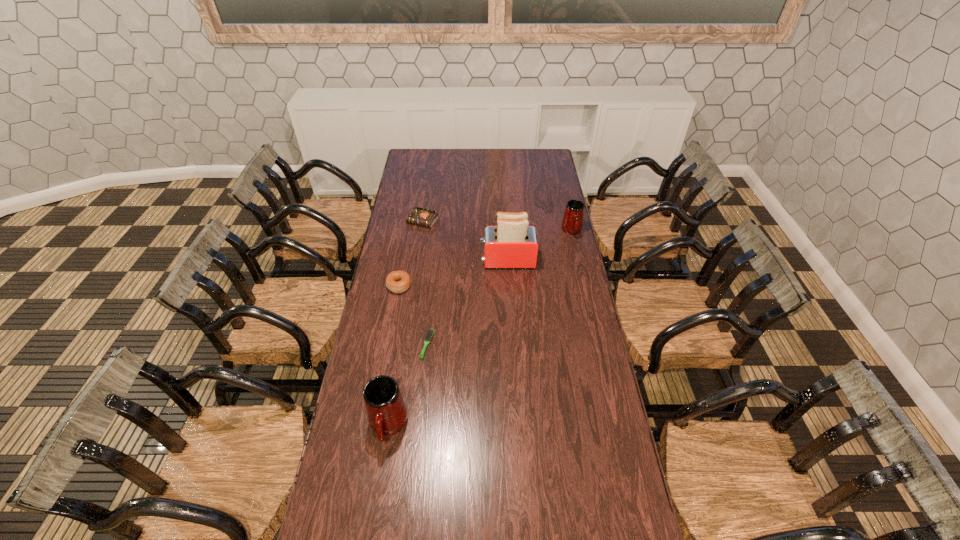
Locate an element on the screen. free space located on the side of the fifth shortest object with the handle is located at coordinates (381, 474).

At what (x,y) coordinates should I click in order to perform the action: click on free space located on the front-facing side of the tallest object. Please return your answer as a coordinate pair (x, y). Image resolution: width=960 pixels, height=540 pixels. Looking at the image, I should click on (435, 261).

Find the location of `free space located on the front-facing side of the tallest object`. free space located on the front-facing side of the tallest object is located at coordinates (415, 261).

Find the location of a particular element. This screenshot has height=540, width=960. free space located on the front-facing side of the tallest object is located at coordinates (396, 261).

Where is `vacant space situated on the back of the diary`? The width and height of the screenshot is (960, 540). vacant space situated on the back of the diary is located at coordinates (426, 197).

Find the location of a particular element. The width and height of the screenshot is (960, 540). blank area located 0.360m on the right of the third nearest object is located at coordinates (494, 286).

Identify the location of vacant region located 0.120m on the back of the hairbrush. Image resolution: width=960 pixels, height=540 pixels. (431, 308).

The image size is (960, 540). Find the location of `mug that is at the left edge`. mug that is at the left edge is located at coordinates (387, 414).

At what (x,y) coordinates should I click in order to perform the action: click on diary present at the left edge. Please return your answer as a coordinate pair (x, y). Image resolution: width=960 pixels, height=540 pixels. Looking at the image, I should click on (419, 216).

Find the location of a particular element. This screenshot has height=540, width=960. bagel present at the left edge is located at coordinates (397, 281).